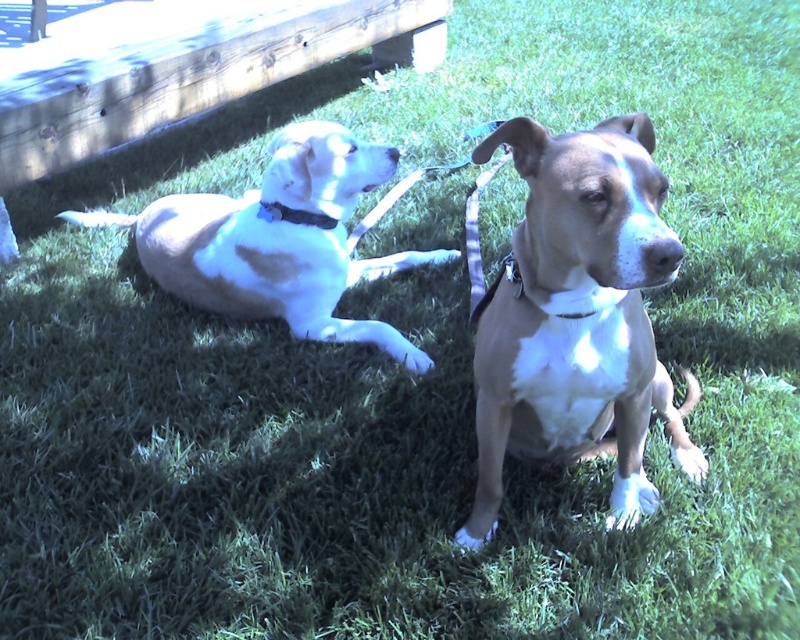
Question: Is brown matte dog at center positioned at the back of light brown fur at left?

Choices:
 (A) yes
 (B) no

Answer: (B)

Question: Which point is farther to the camera?

Choices:
 (A) matte blue collar at upper left
 (B) light brown fur at left

Answer: (A)

Question: Which point is closer to the camera taking this photo?

Choices:
 (A) (286, 212)
 (B) (636, 157)

Answer: (B)

Question: Considering the relative positions of brown matte dog at center and light brown fur at left in the image provided, where is brown matte dog at center located with respect to light brown fur at left?

Choices:
 (A) left
 (B) right

Answer: (B)

Question: Is light brown fur at left above matte blue collar at upper left?

Choices:
 (A) yes
 (B) no

Answer: (A)

Question: Which point is closer to the camera?

Choices:
 (A) brown matte dog at center
 (B) light brown fur at left

Answer: (A)